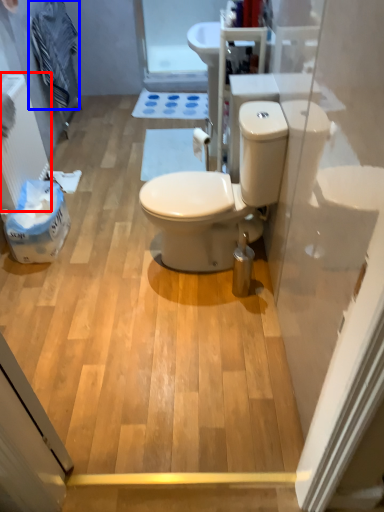
Question: Which object appears farthest to the camera in this image, radiator (highlighted by a red box) or laundry (highlighted by a blue box)?

Choices:
 (A) radiator
 (B) laundry

Answer: (B)